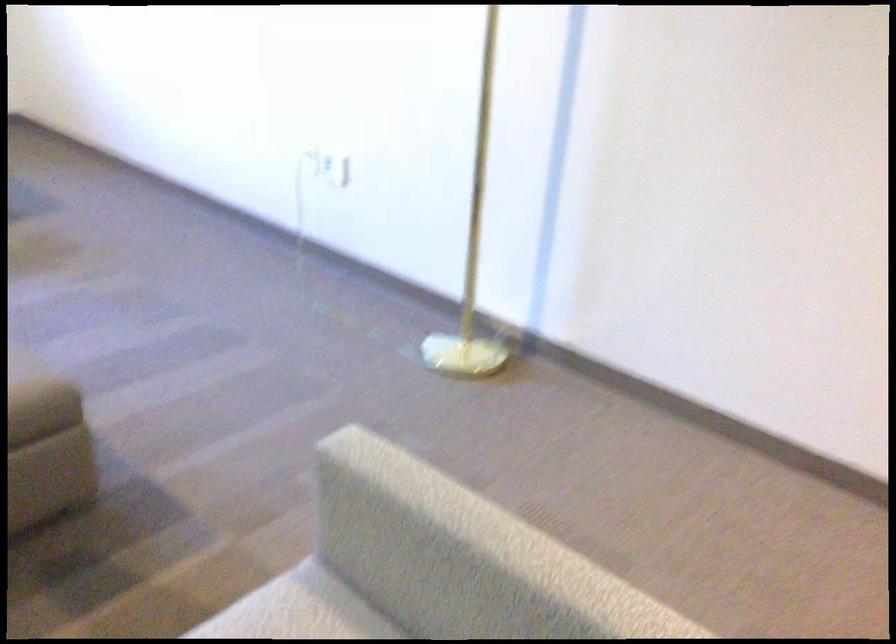
Describe the element at coordinates (421, 489) in the screenshot. This screenshot has height=644, width=896. I see `the white sofa armrest` at that location.